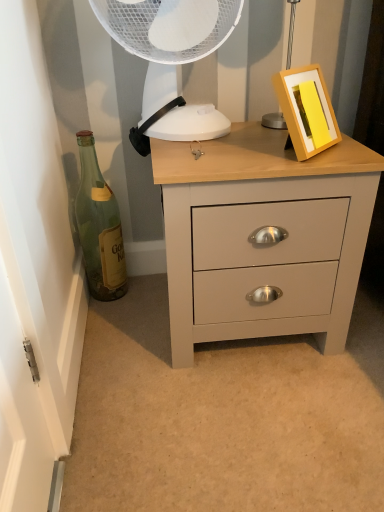
Locate an element on the screen. The image size is (384, 512). vacant space to the left of matte gray chest of drawers at center is located at coordinates click(x=125, y=334).